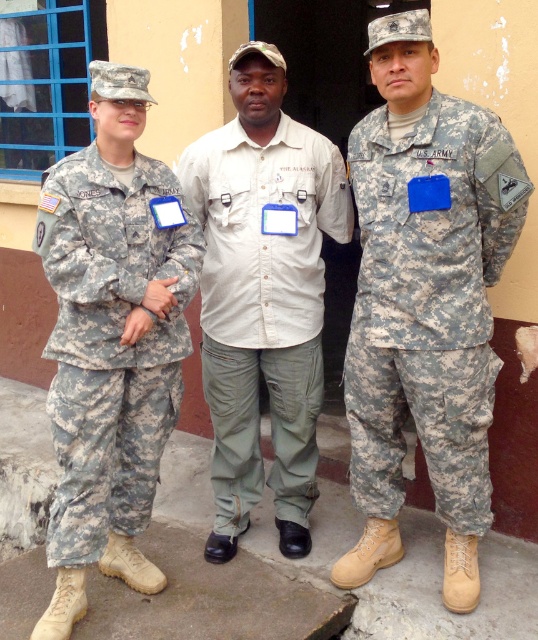
You are a tailor who needs to adjust the light beige cotton shirt at center and the camouflage fabric pants at left to ensure they fit properly. Based on the image, which clothing item requires more fabric to be added to achieve a proper fit?

The light beige cotton shirt at center has a larger size compared to camouflage fabric pants at left, so the light beige cotton shirt at center requires more fabric to be added to achieve a proper fit.

From the picture: You are a photographer trying to capture a group photo of the three people. You notice the camouflage fabric uniform at center and the camouflage fabric pants at left. Which one should you focus on first to ensure they are in sharp focus?

The camouflage fabric pants at left should be focused on first because the camouflage fabric uniform at center is located above it, meaning the pants are closer to the camera.

You are a tailor who needs to determine if the camouflage fabric uniform at center and the camouflage fabric pants at left can be altered to fit a client who requires a medium size. Given their current sizes, which one is more likely to fit without significant alterations?

The camouflage fabric pants at left are smaller in size than the camouflage fabric uniform at center, so the camouflage fabric uniform at center is more likely to fit without significant alterations as it is larger and closer to a medium size.